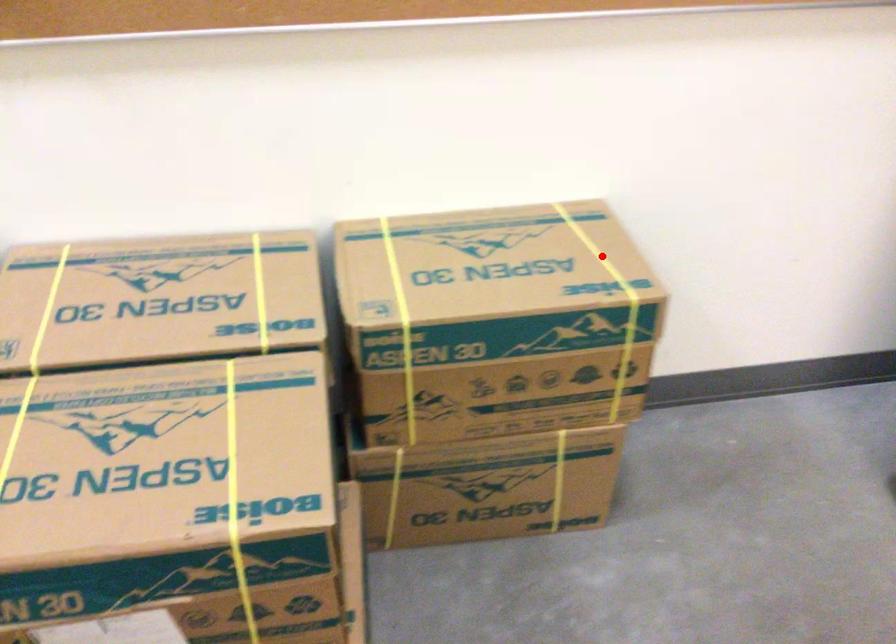
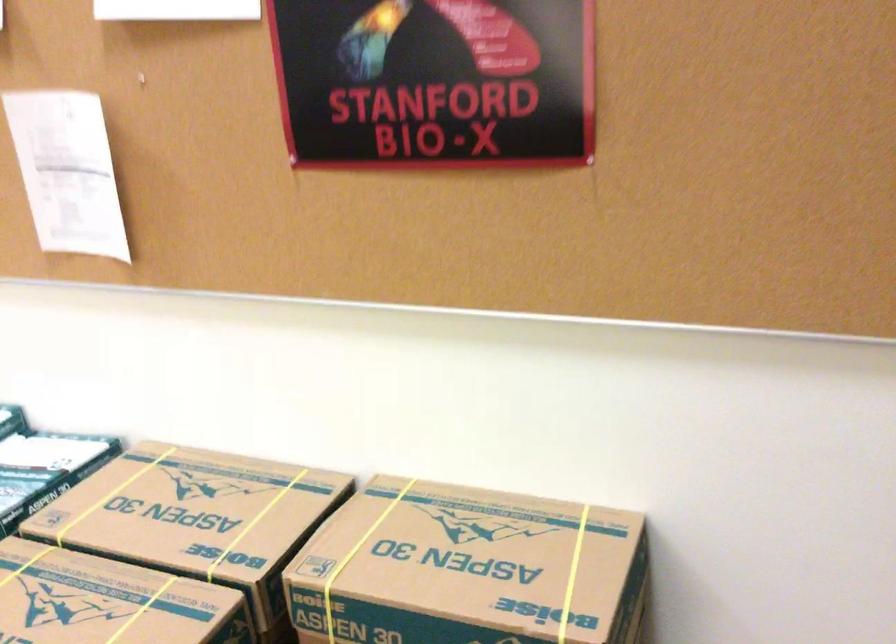
The point at the highlighted location is marked in the first image. Where is the corresponding point in the second image?

(572, 574)